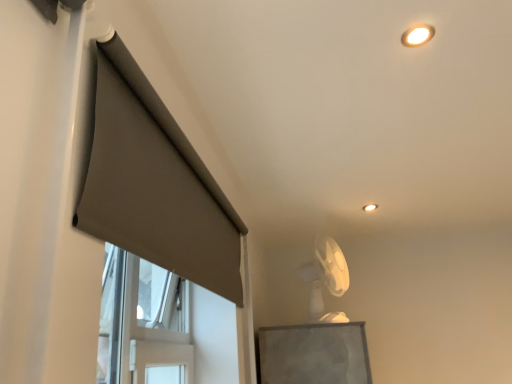
What do you see at coordinates (370, 207) in the screenshot?
I see `matte white ceiling light at upper center` at bounding box center [370, 207].

This screenshot has height=384, width=512. Identify the location of white plastic fan at upper center. [325, 279].

Does matte gray curtain at left appear on the right side of white plastic fan at upper center?

No, matte gray curtain at left is not to the right of white plastic fan at upper center.

The width and height of the screenshot is (512, 384). In the image, there is a matte gray curtain at left. Find the location of `fan below it (from the image's perspective)`. fan below it (from the image's perspective) is located at coordinates (325, 279).

From the image's perspective, which one is positioned higher, matte gray curtain at left or white plastic fan at upper center?

From the image's view, matte gray curtain at left is above.

Between point (345, 261) and point (370, 204), which one is positioned in front?

The point (370, 204) is in front.

From the image's perspective, which one is positioned lower, white plastic fan at upper center or matte white ceiling light at upper center?

From the image's view, white plastic fan at upper center is below.

From a real-world perspective, is white plastic fan at upper center below matte white ceiling light at upper center?

Yes, from a real-world perspective, white plastic fan at upper center is below matte white ceiling light at upper center.

Which object is positioned more to the right, white plastic fan at upper center or matte white ceiling light at upper center?

Positioned to the right is matte white ceiling light at upper center.

Between white plastic fan at upper center and matte gray curtain at left, which one appears on the right side from the viewer's perspective?

Positioned to the right is white plastic fan at upper center.

Which object is closer to the camera, white plastic fan at upper center or matte gray curtain at left?

Positioned in front is matte gray curtain at left.

Is white plastic fan at upper center oriented away from matte gray curtain at left?

That's not correct — white plastic fan at upper center is not looking away from matte gray curtain at left.

Looking at the image, does matte white ceiling light at upper center seem bigger or smaller compared to matte gray curtain at left?

In the image, matte white ceiling light at upper center appears to be smaller than matte gray curtain at left.

Does point (367, 205) come in front of point (236, 278)?

No, it is not.

Is matte white ceiling light at upper center facing away from matte gray curtain at left?

matte white ceiling light at upper center does not have its back to matte gray curtain at left.

Is matte white ceiling light at upper center at the left side of matte gray curtain at left?

No, matte white ceiling light at upper center is not to the left of matte gray curtain at left.

Does matte white ceiling light at upper center have a larger size compared to white plastic fan at upper center?

No, matte white ceiling light at upper center is not bigger than white plastic fan at upper center.

Is point (362, 208) farther from camera compared to point (322, 265)?

Yes, point (362, 208) is farther from viewer.

Can you confirm if matte white ceiling light at upper center is positioned to the left of white plastic fan at upper center?

No, matte white ceiling light at upper center is not to the left of white plastic fan at upper center.

From a real-world perspective, which object stands above the other?

matte white ceiling light at upper center is physically above.

Which is behind, matte gray curtain at left or matte white ceiling light at upper center?

matte white ceiling light at upper center is behind.

In terms of height, does matte gray curtain at left look taller or shorter compared to matte white ceiling light at upper center?

Clearly, matte gray curtain at left is taller compared to matte white ceiling light at upper center.

How distant is matte gray curtain at left from matte white ceiling light at upper center?

The distance of matte gray curtain at left from matte white ceiling light at upper center is 1.42 meters.

At what (x,y) coordinates should I click in order to perform the action: click on fan on the right side of matte gray curtain at left. Please return your answer as a coordinate pair (x, y). The height and width of the screenshot is (384, 512). Looking at the image, I should click on (325, 279).

The image size is (512, 384). What are the coordinates of `lighting positioned vertically above the white plastic fan at upper center (from a real-world perspective)` in the screenshot? It's located at (370, 207).

Looking at the image, which one is located closer to white plastic fan at upper center, matte white ceiling light at upper center or matte gray curtain at left?

matte white ceiling light at upper center.

When comparing their distances from matte gray curtain at left, does white plastic fan at upper center or matte white ceiling light at upper center seem further?

Among the two, matte white ceiling light at upper center is located further to matte gray curtain at left.

Which object lies nearer to the anchor point matte white ceiling light at upper center, white plastic fan at upper center or matte gray curtain at left?

white plastic fan at upper center.

When comparing their distances from matte white ceiling light at upper center, does matte gray curtain at left or white plastic fan at upper center seem further?

matte gray curtain at left is further to matte white ceiling light at upper center.

Estimate the real-world distances between objects in this image. Which object is further from white plastic fan at upper center, matte gray curtain at left or matte white ceiling light at upper center?

matte gray curtain at left is positioned further to the anchor white plastic fan at upper center.

Which object lies further to the anchor point matte gray curtain at left, matte white ceiling light at upper center or white plastic fan at upper center?

Based on the image, matte white ceiling light at upper center appears to be further to matte gray curtain at left.

Locate an element on the screen. fan located between matte gray curtain at left and matte white ceiling light at upper center in the depth direction is located at coordinates (325, 279).